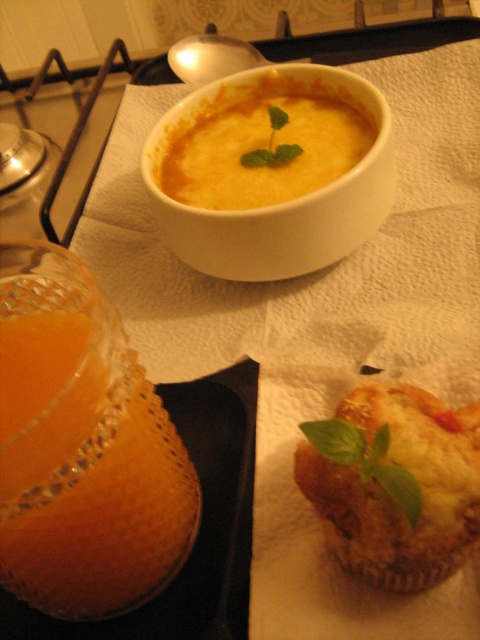
You are a chef arranging ingredients on a table. You have a translucent glass cup of orange juice at lower left and a green leafy basil at center. Which item is closer to the edge of the table?

The translucent glass cup of orange juice at lower left is positioned under the green leafy basil at center, so it is closer to the edge of the table.

You are setting up a breakfast tray and need to place both the translucent glass cup of orange juice at lower left and the golden brown muffin at lower right. If the tray has limited space, which item should you prioritize placing first to ensure both fit?

The golden brown muffin at lower right should be placed first because the translucent glass cup of orange juice at lower left is wider, so positioning the narrower muffin first allows more flexibility to fit the wider cup next.